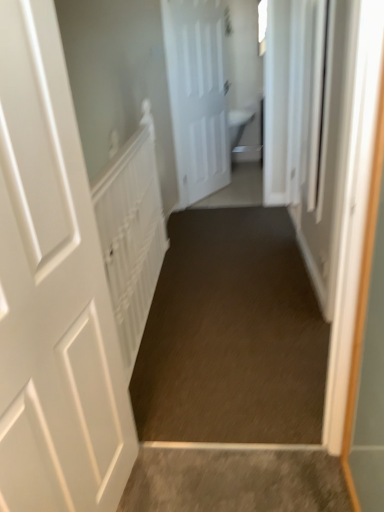
Question: Is white matte door at center, placed as the first door when sorted from top to bottom, taller or shorter than white textured radiator at left?

Choices:
 (A) tall
 (B) short

Answer: (A)

Question: Considering the positions of white matte door at center, placed as the first door when sorted from top to bottom, and white textured radiator at left in the image, is white matte door at center, placed as the first door when sorted from top to bottom, wider or thinner than white textured radiator at left?

Choices:
 (A) thin
 (B) wide

Answer: (A)

Question: Which object is positioned closest to the white textured radiator at left?

Choices:
 (A) white matte door at left, which appears as the first door when viewed from the front
 (B) white matte door at center, which is the first door from right to left
 (C) brown carpet at center

Answer: (C)

Question: Which object is the farthest from the brown carpet at center?

Choices:
 (A) white textured radiator at left
 (B) white matte door at center, acting as the 1th door starting from the back
 (C) white matte door at left, placed as the first door when sorted from left to right

Answer: (B)